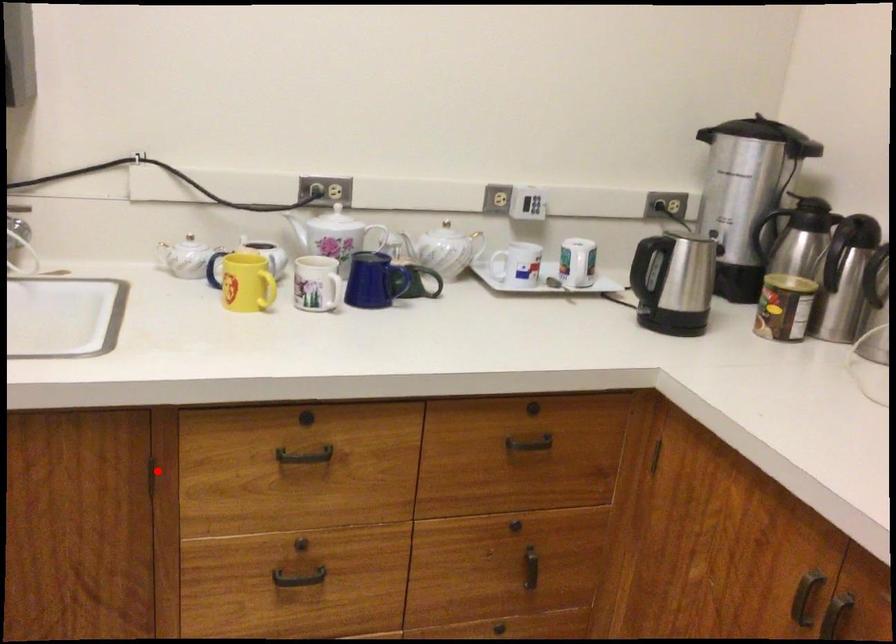
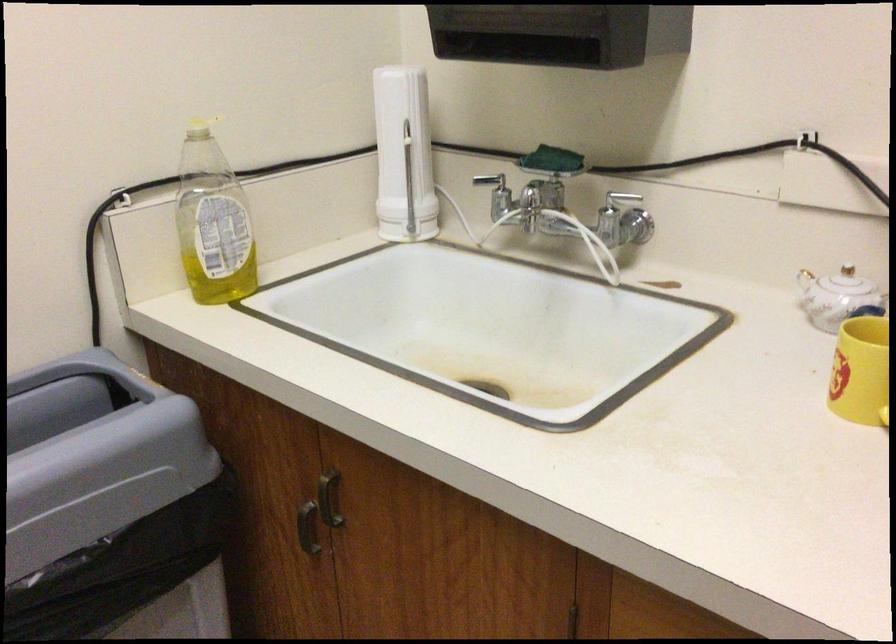
Question: I am providing you with two images of the same scene from different viewpoints. A red point is marked on the first image. At the location where the point appears in image 1, is it still visible in image 2?

Choices:
 (A) Yes
 (B) No

Answer: (A)